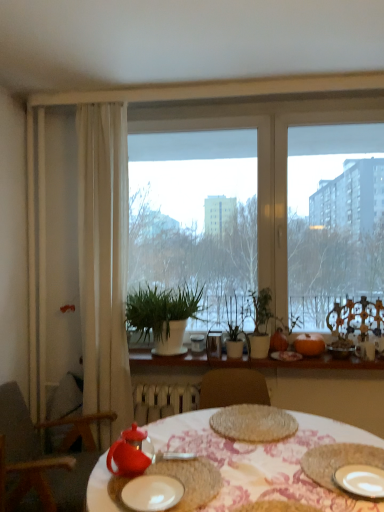
Describe the element at coordinates (104, 263) in the screenshot. The image size is (384, 512). I see `white sheer curtain at left` at that location.

At what (x,y) coordinates should I click in order to perform the action: click on matte red teapot at center. Please return your answer as a coordinate pair (x, y). Looking at the image, I should click on (263, 459).

The height and width of the screenshot is (512, 384). What do you see at coordinates (338, 461) in the screenshot?
I see `rustic woven placemat at lower right` at bounding box center [338, 461].

Image resolution: width=384 pixels, height=512 pixels. What do you see at coordinates (163, 314) in the screenshot?
I see `white matte plant pot at center` at bounding box center [163, 314].

The width and height of the screenshot is (384, 512). What do you see at coordinates (152, 493) in the screenshot?
I see `white matte plate at center, the 2th plate viewed from the right` at bounding box center [152, 493].

In order to click on metallic glass at center, the third tableware when ordered from right to left in this screenshot , I will do `click(214, 344)`.

Between white ceramic plate at lower right, placed as the first plate when sorted from right to left, and metallic glass at center, the third tableware when ordered from right to left, which one is positioned in front?

white ceramic plate at lower right, placed as the first plate when sorted from right to left, is closer to the camera.

Which object is positioned more to the left, white ceramic plate at lower right, placed as the first plate when sorted from right to left, or metallic glass at center, the fourth tableware positioned from the front?

From the viewer's perspective, metallic glass at center, the fourth tableware positioned from the front, appears more on the left side.

Is point (351, 489) more distant than point (216, 338)?

That is False.

Locate an element on the screen. plant beneath the transparent glass window at center (from a real-world perspective) is located at coordinates (236, 320).

Is transparent glass window at center in front of or behind green matte plant at center in the image?

In the image, transparent glass window at center appears behind green matte plant at center.

Can you confirm if transparent glass window at center is bigger than green matte plant at center?

Answer: Yes.

Is matte red teapot at center bigger or smaller than wooden chair at left?

Clearly, matte red teapot at center is smaller in size than wooden chair at left.

Which object is closer to the camera, matte red teapot at center or wooden chair at left?

matte red teapot at center is in front.

From the image's perspective, which is below, matte red teapot at center or wooden chair at left?

wooden chair at left.

Is matte red teapot at center facing away from wooden chair at left?

No, matte red teapot at center is not facing away from wooden chair at left.

Between matte ceramic pumpkin at center, the 3th tableware when ordered from back to front, and white sheer curtain at left, which one has smaller size?

matte ceramic pumpkin at center, the 3th tableware when ordered from back to front.

Between point (288, 357) and point (86, 216), which one is positioned behind?

The point (288, 357) is behind.

From the picture: From a real-world perspective, relative to white sheer curtain at left, is matte ceramic pumpkin at center, which appears as the second tableware when viewed from the front, vertically above or below?

matte ceramic pumpkin at center, which appears as the second tableware when viewed from the front, is situated lower than white sheer curtain at left in the real world.

Would you say matte ceramic pumpkin at center, which appears as the 2th tableware when viewed from the right, is inside or outside white sheer curtain at left?

matte ceramic pumpkin at center, which appears as the 2th tableware when viewed from the right, is spatially situated outside white sheer curtain at left.

From the image's perspective, is orange matte pumpkin at right beneath white ceramic plants at center?

No, from the image's perspective, orange matte pumpkin at right is not below white ceramic plants at center.

From a real-world perspective, is orange matte pumpkin at right located beneath white ceramic plants at center?

Incorrect, from a real-world perspective, orange matte pumpkin at right is higher than white ceramic plants at center.

Considering the sizes of white ceramic plate at lower right, the second plate positioned from the left, and white matte plant pot at center in the image, is white ceramic plate at lower right, the second plate positioned from the left, bigger or smaller than white matte plant pot at center?

In the image, white ceramic plate at lower right, the second plate positioned from the left, appears to be smaller than white matte plant pot at center.

Considering the sizes of objects white ceramic plate at lower right, placed as the first plate when sorted from right to left, and white matte plant pot at center in the image provided, who is shorter, white ceramic plate at lower right, placed as the first plate when sorted from right to left, or white matte plant pot at center?

white ceramic plate at lower right, placed as the first plate when sorted from right to left, is shorter.

Considering the positions of point (357, 479) and point (146, 296), is point (357, 479) closer or farther from the camera than point (146, 296)?

Point (357, 479) is positioned closer to the camera compared to point (146, 296).

From the image's perspective, which is below, white ceramic plate at lower right, placed as the first plate when sorted from right to left, or woven mat at center?

white ceramic plate at lower right, placed as the first plate when sorted from right to left, from the image's perspective.

Looking at this image, is the depth of white ceramic plate at lower right, placed as the first plate when sorted from right to left, greater than that of woven mat at center?

No, white ceramic plate at lower right, placed as the first plate when sorted from right to left, is closer to the camera.

Does white ceramic plate at lower right, placed as the first plate when sorted from right to left, have a larger size compared to woven mat at center?

Actually, white ceramic plate at lower right, placed as the first plate when sorted from right to left, might be smaller than woven mat at center.

Which object is thinner, white ceramic plate at lower right, placed as the first plate when sorted from right to left, or woven mat at center?

Thinner between the two is white ceramic plate at lower right, placed as the first plate when sorted from right to left.

Find the location of a particular element. tableware that is the 4th one above the white ceramic plate at lower right, the second plate positioned from the left (from a real-world perspective) is located at coordinates (214, 344).

Image resolution: width=384 pixels, height=512 pixels. In order to click on window behind the green matte plant at center in this screenshot , I will do `click(265, 159)`.

Which object lies nearer to the anchor point woven mat at center, matte ceramic pumpkin at center, which appears as the second tableware when viewed from the front, or white sheer curtain at left?

matte ceramic pumpkin at center, which appears as the second tableware when viewed from the front, is positioned closer to the anchor woven mat at center.

When comparing their distances from metallic glass at center, the second tableware positioned from the left, does matte glass bowl at right, marked as the second tableware in a back-to-front arrangement, or transparent glass window at center seem further?

Based on the image, transparent glass window at center appears to be further to metallic glass at center, the second tableware positioned from the left.

Based on their spatial positions, is rustic woven placemat at lower right or metallic glass at center, the third tableware when ordered from right to left, further from matte red teapot at center?

Based on the image, metallic glass at center, the third tableware when ordered from right to left, appears to be further to matte red teapot at center.

Which object lies further to the anchor point orange matte pumpkin at right, matte red teapot at lower left or white matte plant pot at center?

matte red teapot at lower left.

When comparing their distances from woven mat at center, does matte ceramic pumpkin at center, which appears as the second tableware when viewed from the front, or matte red teapot at center seem closer?

Based on the image, matte red teapot at center appears to be nearer to woven mat at center.

From the image, which object appears to be nearer to metallic glass at center, the second tableware positioned from the left, white sheer curtain at left or matte red teapot at center?

white sheer curtain at left lies closer to metallic glass at center, the second tableware positioned from the left, than the other object.

Considering their positions, is rustic woven placemat at lower right positioned further to wooden chair at left than matte red teapot at center?

rustic woven placemat at lower right lies further to wooden chair at left than the other object.

Estimate the real-world distances between objects in this image. Which object is further from rustic woven placemat at lower right, woven mat at center or matte red teapot at center?

Among the two, woven mat at center is located further to rustic woven placemat at lower right.

At what (x,y) coordinates should I click in order to perform the action: click on meal located between white matte plate at center, the 2th plate viewed from the right, and white sheer curtain at left in the depth direction. Please return your answer as a coordinate pair (x, y). Looking at the image, I should click on (99, 488).

Find the location of a particular element. The width and height of the screenshot is (384, 512). meal between wooden chair at left and woven mat at center from left to right is located at coordinates (99, 488).

Where is `houseplant between white ceramic plate at lower right, placed as the first plate when sorted from right to left, and metallic glass at center, the first tableware when ordered from back to front, along the z-axis`? The width and height of the screenshot is (384, 512). houseplant between white ceramic plate at lower right, placed as the first plate when sorted from right to left, and metallic glass at center, the first tableware when ordered from back to front, along the z-axis is located at coordinates (163, 314).

Locate an element on the screen. food between white matte plate at center, marked as the first plate in a left-to-right arrangement, and orange matte pumpkin at right from front to back is located at coordinates (253, 423).